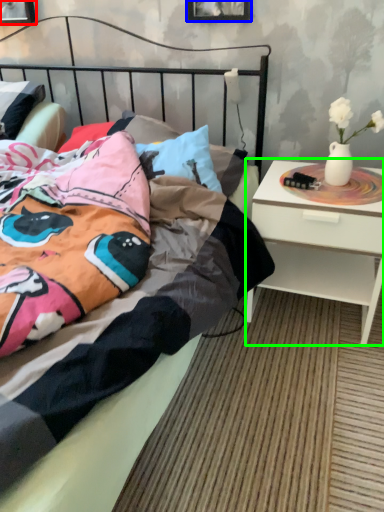
Question: Which object is positioned closest to picture frame (highlighted by a red box)? Select from picture frame (highlighted by a blue box) and nightstand (highlighted by a green box).

Choices:
 (A) picture frame
 (B) nightstand

Answer: (A)